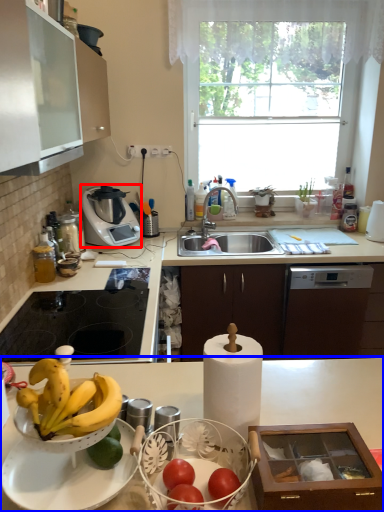
Question: Which of the following is the closest to the observer, kitchen appliance (highlighted by a red box) or countertop (highlighted by a blue box)?

Choices:
 (A) kitchen appliance
 (B) countertop

Answer: (B)